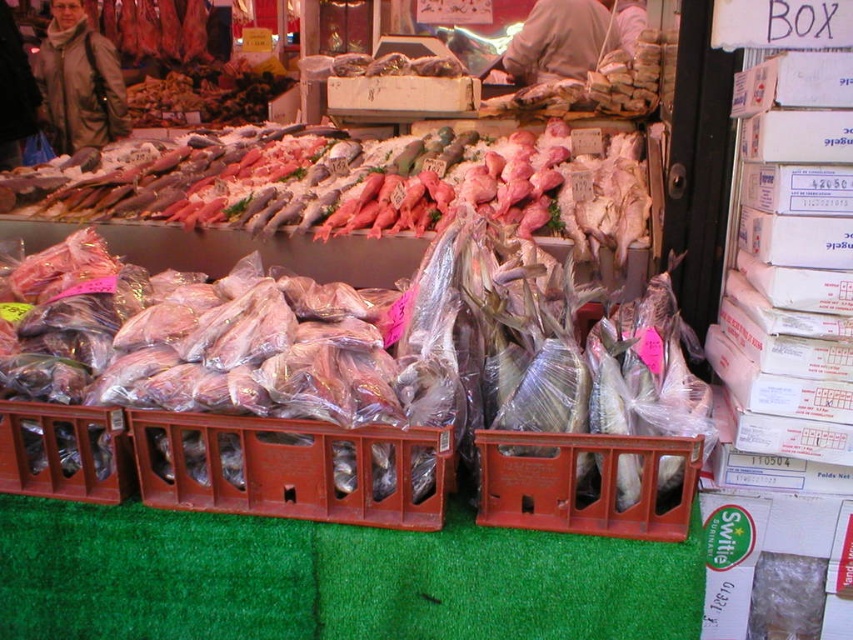
Question: Can you confirm if brown plastic crate at center is positioned to the left of brown leather jacket at upper center?

Choices:
 (A) no
 (B) yes

Answer: (B)

Question: Which point is farther from the camera taking this photo?

Choices:
 (A) pyautogui.click(x=44, y=74)
 (B) pyautogui.click(x=692, y=451)
 (C) pyautogui.click(x=616, y=44)

Answer: (A)

Question: Estimate the real-world distances between objects in this image. Which object is closer to the leather jacket at upper left?

Choices:
 (A) orange plastic crate at center
 (B) brown leather jacket at upper center
 (C) brown plastic crate at center

Answer: (B)

Question: Is brown plastic crate at center further to camera compared to brown leather jacket at upper center?

Choices:
 (A) yes
 (B) no

Answer: (B)

Question: Is leather jacket at upper left further to camera compared to brown leather jacket at upper center?

Choices:
 (A) no
 (B) yes

Answer: (B)

Question: Which of these objects is positioned closest to the leather jacket at upper left?

Choices:
 (A) brown plastic crate at center
 (B) orange plastic crate at center
 (C) brown leather jacket at upper center

Answer: (C)